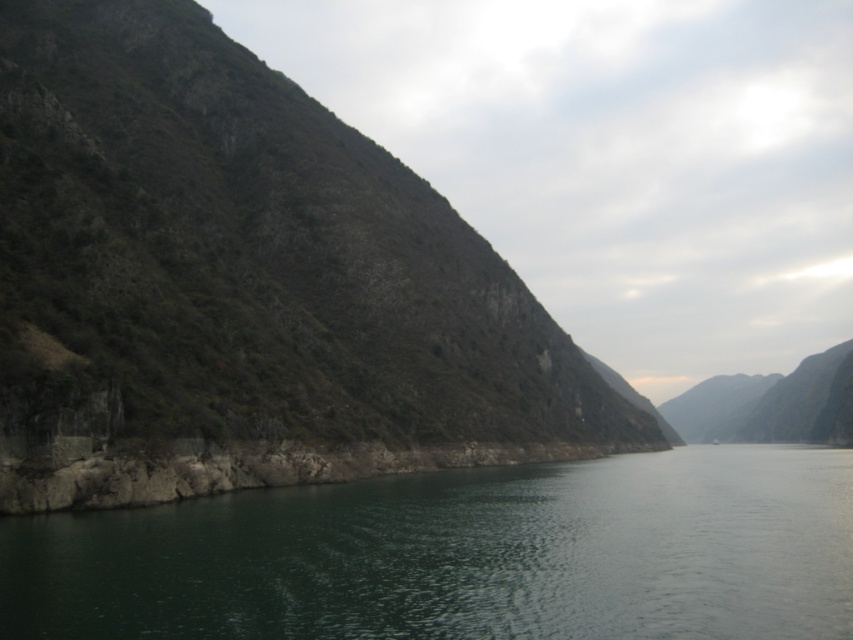
Question: Can you confirm if green rocky mountain at left is positioned below green smooth water at center?

Choices:
 (A) no
 (B) yes

Answer: (A)

Question: Where is green rocky mountain at left located in relation to green smooth water at center in the image?

Choices:
 (A) left
 (B) right

Answer: (A)

Question: Which point is closer to the camera taking this photo?

Choices:
 (A) (613, 465)
 (B) (392, 212)

Answer: (A)

Question: Which of the following is the farthest from the observer?

Choices:
 (A) (250, 81)
 (B) (456, 540)

Answer: (A)

Question: Is green rocky mountain at left positioned at the back of green smooth water at center?

Choices:
 (A) no
 (B) yes

Answer: (B)